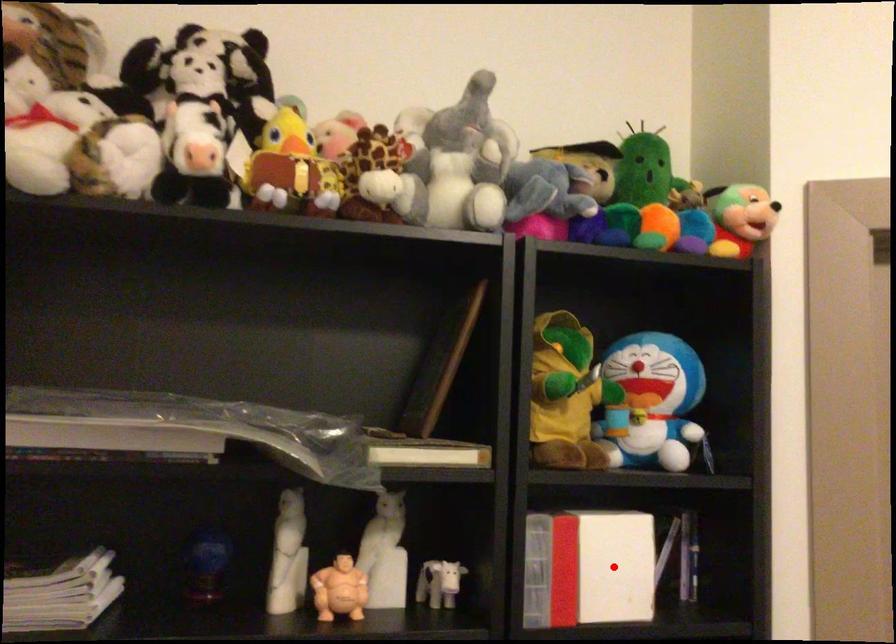
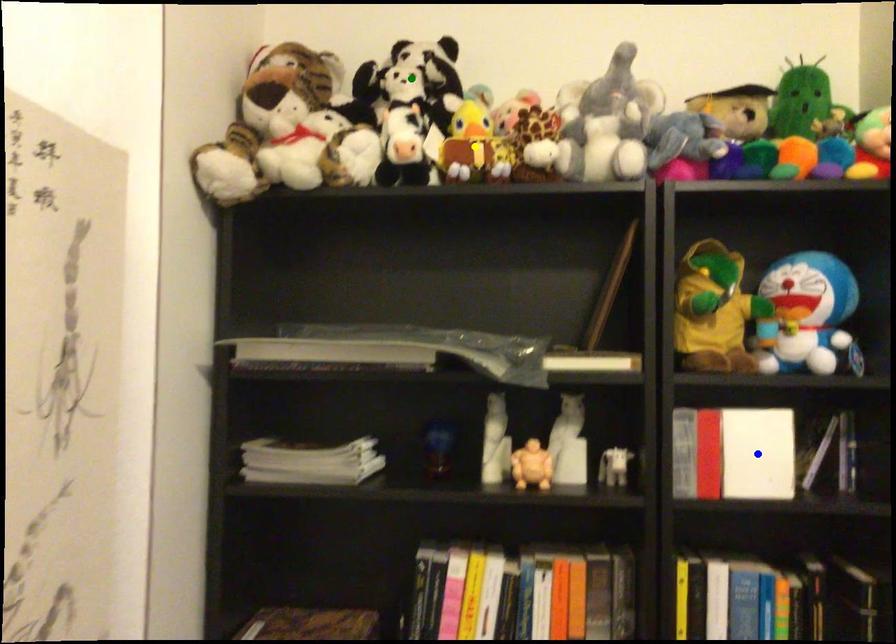
Question: I am providing you with two images of the same scene from different viewpoints. A red point is marked on the first image. You are given multiple points on the second image. Which mark in image 2 goes with the point in image 1?

Choices:
 (A) blue point
 (B) green point
 (C) yellow point

Answer: (A)